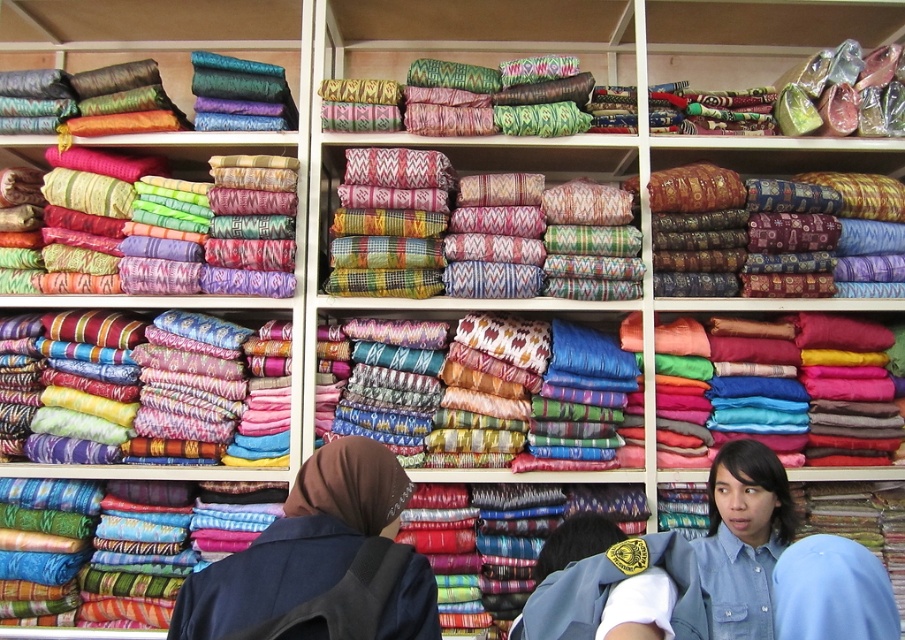
You are a customer in the textile shop and want to pick up both the matte silk scarf at center and the dark blue fabric at lower left. How far apart are these two items from each other?

The distance between the matte silk scarf at center and the dark blue fabric at lower left is 5.92 feet.

You are a customer in the shop and want to see the dark blue fabric at lower left. However, the matte silk scarf at center is blocking your view. Can you move the scarf to access the fabric?

The dark blue fabric at lower left is behind the matte silk scarf at center, so you can move the matte silk scarf at center to access the dark blue fabric at lower left.